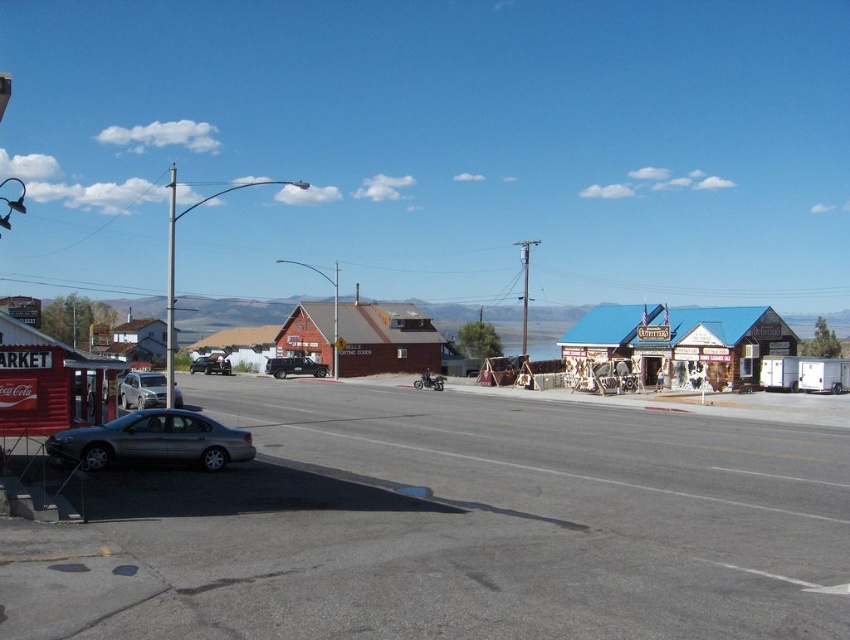
The width and height of the screenshot is (850, 640). Describe the element at coordinates (680, 344) in the screenshot. I see `wooden signboard at center` at that location.

Can you confirm if wooden signboard at center is bigger than matte black truck at center?

Yes, wooden signboard at center is bigger than matte black truck at center.

This screenshot has width=850, height=640. What are the coordinates of `wooden signboard at center` in the screenshot? It's located at (680, 344).

Who is higher up, red wooden market at lower left or rustic wood cabin at center?

rustic wood cabin at center is above.

Who is lower down, red wooden market at lower left or rustic wood cabin at center?

Positioned lower is red wooden market at lower left.

Between point (1, 413) and point (299, 324), which one is positioned behind?

Positioned behind is point (299, 324).

Where is `red wooden market at lower left`? red wooden market at lower left is located at coordinates (51, 381).

Can you confirm if red wooden market at lower left is positioned above metallic pole at left?

No.

Image resolution: width=850 pixels, height=640 pixels. What do you see at coordinates (51, 381) in the screenshot?
I see `red wooden market at lower left` at bounding box center [51, 381].

Does point (27, 372) come farther from viewer compared to point (173, 225)?

No, (27, 372) is in front of (173, 225).

Image resolution: width=850 pixels, height=640 pixels. Identify the location of red wooden market at lower left. (51, 381).